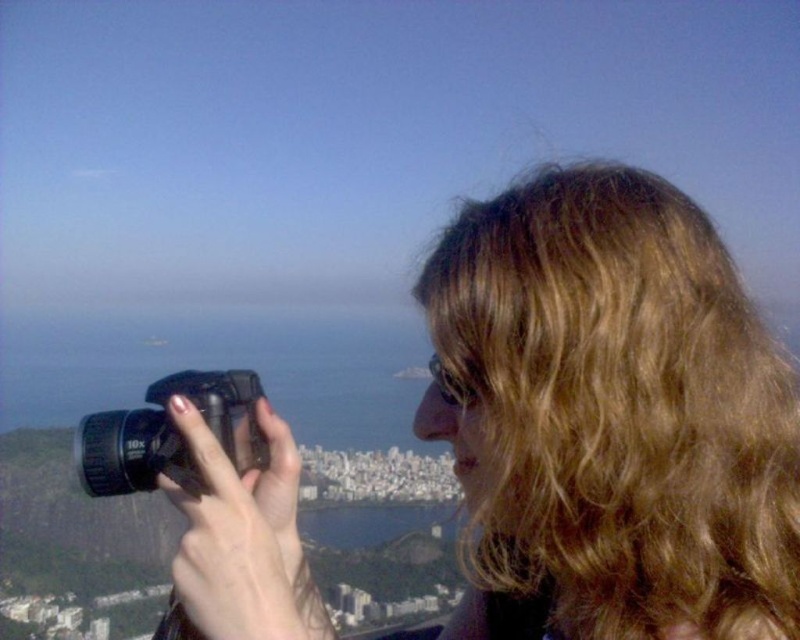
Can you confirm if blonde curly hair at upper right is positioned to the right of black plastic camera at center?

Yes, blonde curly hair at upper right is to the right of black plastic camera at center.

What do you see at coordinates (616, 410) in the screenshot? I see `blonde curly hair at upper right` at bounding box center [616, 410].

Image resolution: width=800 pixels, height=640 pixels. Find the location of `blonde curly hair at upper right`. blonde curly hair at upper right is located at coordinates (616, 410).